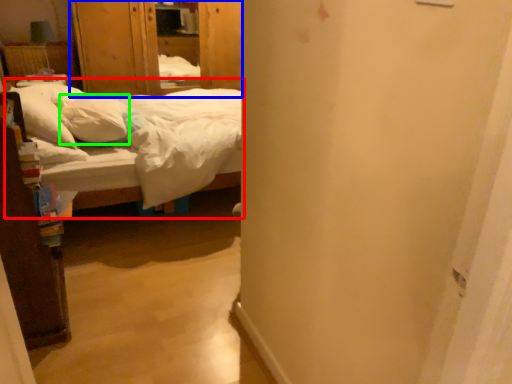
Question: Which object is positioned farthest from bed (highlighted by a red box)? Select from armoire (highlighted by a blue box) and pillow (highlighted by a green box).

Choices:
 (A) armoire
 (B) pillow

Answer: (A)